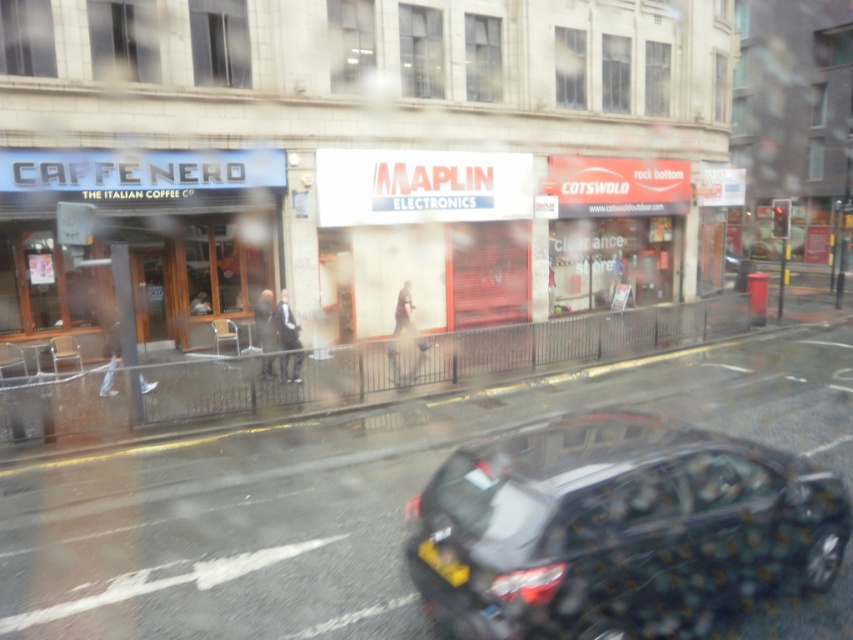
You are a delivery person looking at the street through a wet window. You need to deliver a package to the matte black storefront at left and then to the yellow matte license plate at lower center. Which location should you visit first based on their positions?

You should visit the matte black storefront at left first because it is positioned to the left of the yellow matte license plate at lower center, meaning it is closer to your current position near the window.

You are a delivery driver who needs to ensure your license plate is visible for security cameras. Based on the scene, can you confirm if the yellow matte license plate at lower center is fully visible without being blocked by the metallic gray hatchback at lower center?

The metallic gray hatchback at lower center is taller than the yellow matte license plate at lower center, so part of the license plate might be blocked by the car, making it less visible to security cameras.

You are a pedestrian standing on the sidewalk and want to cross the street to the matte black storefront at left. There is a metallic gray hatchback at lower center blocking the way. Can you walk around it to reach the storefront?

The metallic gray hatchback at lower center is positioned on the right side of the matte black storefront at left, so you can walk around the left side of the metallic gray hatchback at lower center to reach the matte black storefront at left.